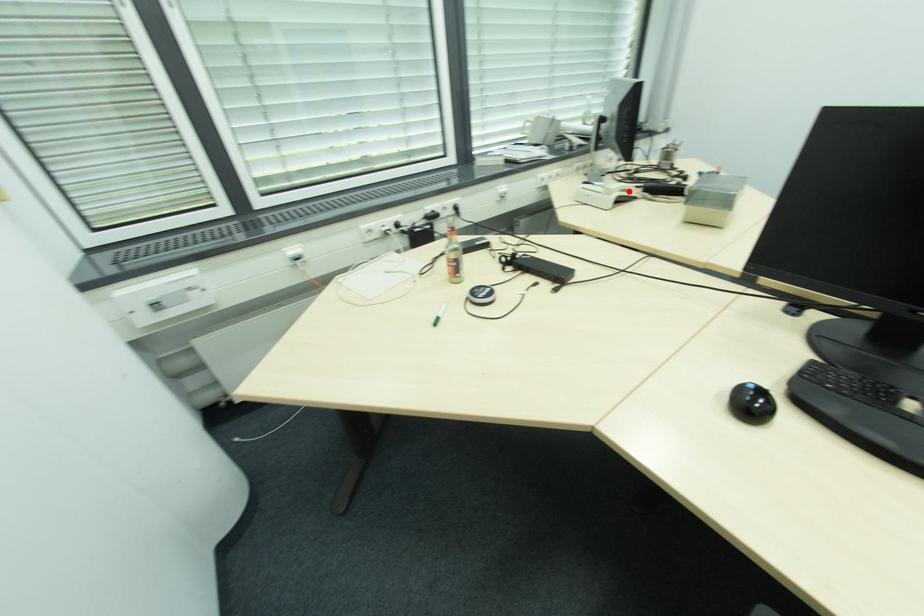
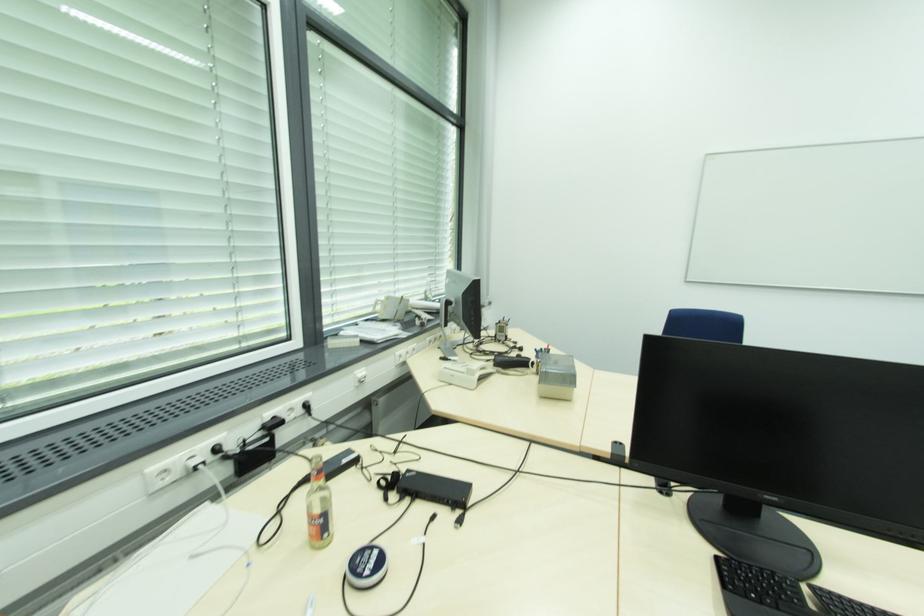
In the second image, find the point that corresponds to the highlighted location in the first image.

(487, 369)